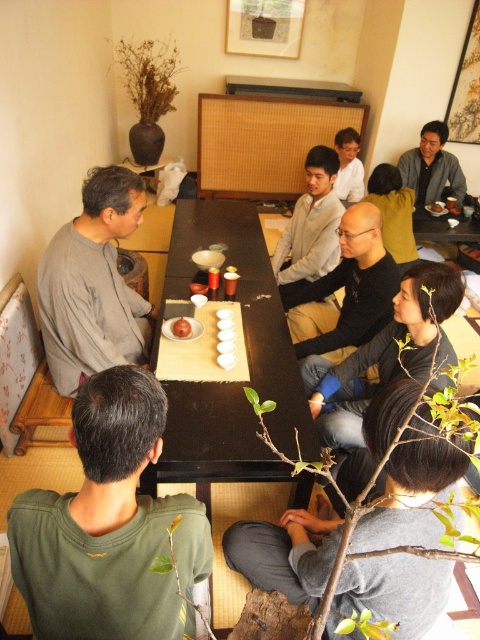
You are standing at the origin point of the coordinate system in the image, which is the bottom left corner. You want to locate the matte gray sweater at upper right. In which direction should you look relative to your current position?

The matte gray sweater at upper right is located at coordinate point [432,168]. Since the origin is at the bottom left corner, the x and y axes increase to the right and upwards respectively. Therefore, you should look to the upper right direction from your current position to locate the matte gray sweater at upper right.

You are a guest at the tea ceremony and want to place your gray cotton shirt at lower center on the table. Is there enough space between it and the smooth brown bowl at upper center?

The gray cotton shirt at lower center is positioned under the smooth brown bowl at upper center, so placing the shirt there may not be possible as the bowl is above it.

You are a photographer planning to take a group photo of the participants in the tea ceremony scene. You need to ensure that the gray cotton shirt at left and the white glossy bowl at center are both visible in the frame. Considering their sizes, which object will require more space horizontally in the photo?

The gray cotton shirt at left requires more horizontal space in the photo since its width surpasses that of the white glossy bowl at center.